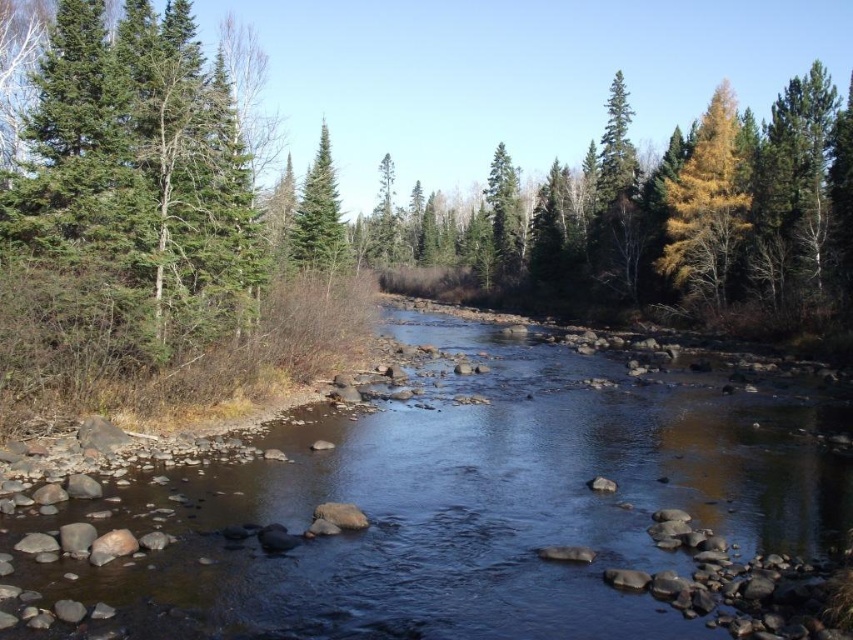
You are standing at the edge of the river and notice the smooth rock stream at center and the green matte tree at center. Which object is located directly above the other?

The green matte tree at center is positioned above the smooth rock stream at center.